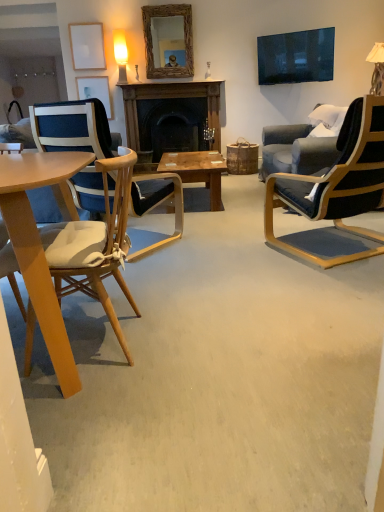
In order to click on free space that is in between black leather chair at right, acting as the third chair starting from the left, and light brown wood chair at left, which appears as the 2th chair when viewed from the left in this screenshot , I will do `click(219, 284)`.